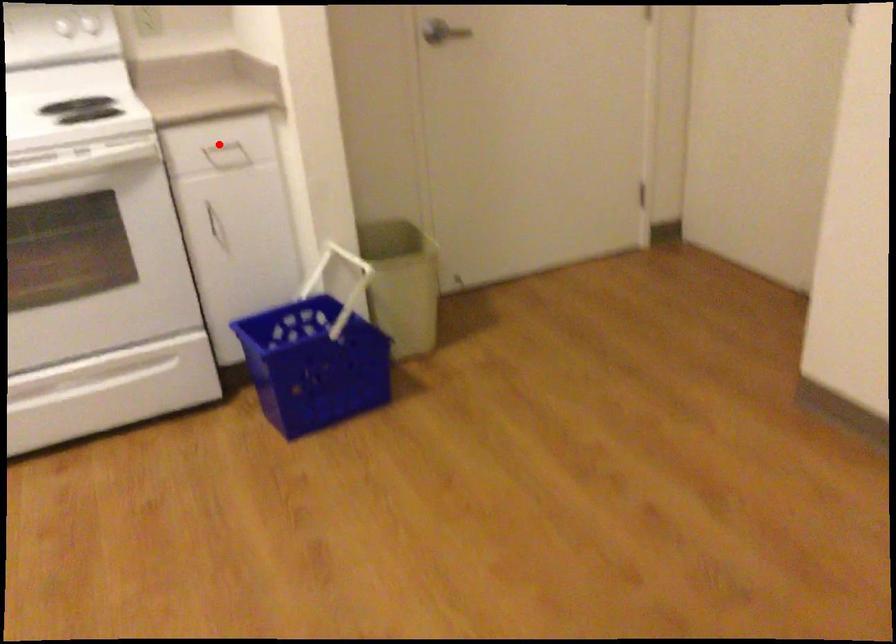
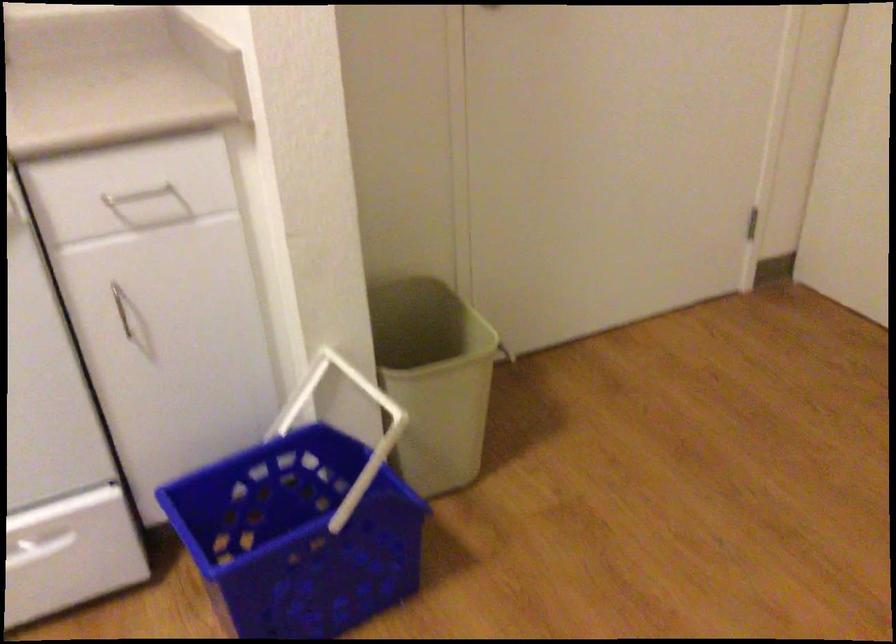
Question: I am providing you with two images of the same scene from different viewpoints. A red point is shown in image1. For the corresponding object point in image2, is it positioned nearer or farther from the camera?

Choices:
 (A) Nearer
 (B) Farther

Answer: (A)